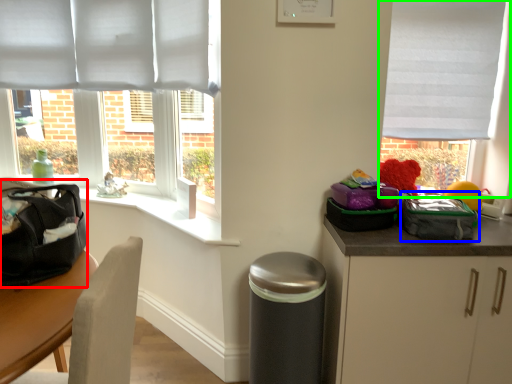
Question: Which object is the closest to the pack (highlighted by a red box)? Choose among these: kit (highlighted by a blue box) or window (highlighted by a green box).

Choices:
 (A) kit
 (B) window

Answer: (A)